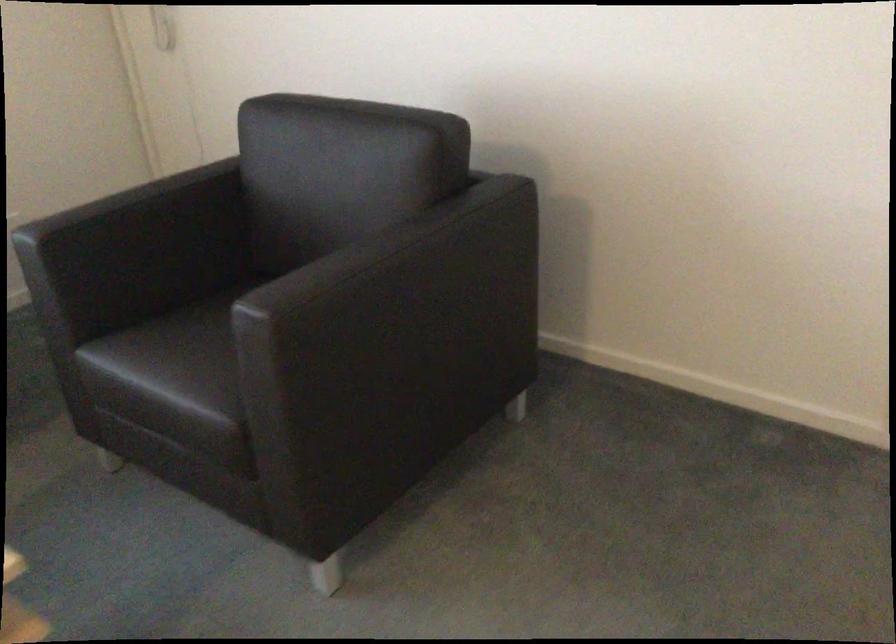
Describe the element at coordinates (168, 366) in the screenshot. This screenshot has height=644, width=896. I see `the black chair sitting surface` at that location.